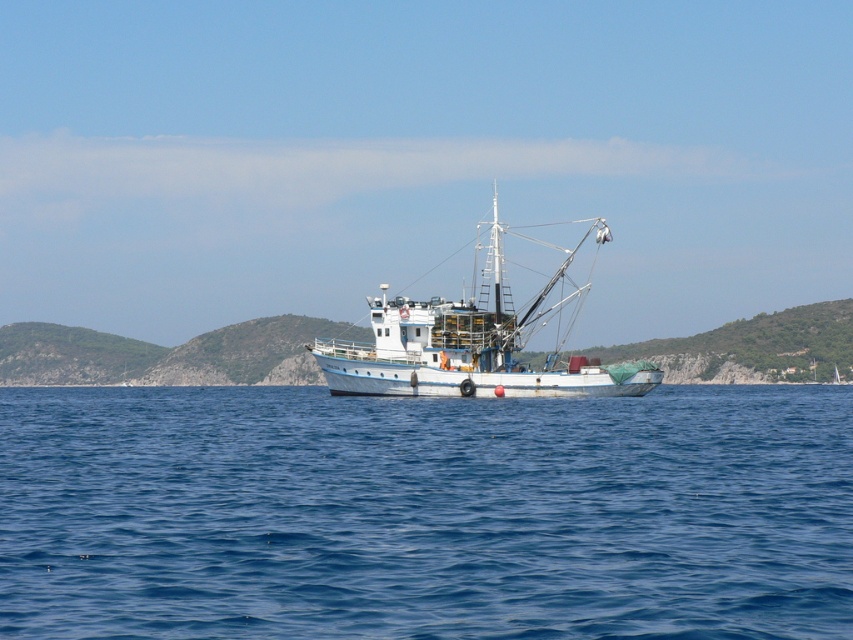
You are a sailor on the white matte boat at center. You want to check the water level below your boat. Which direction should you look to see the blue water at center?

The blue water at center is located below the white matte boat at center, so you should look downward to see the blue water at center.